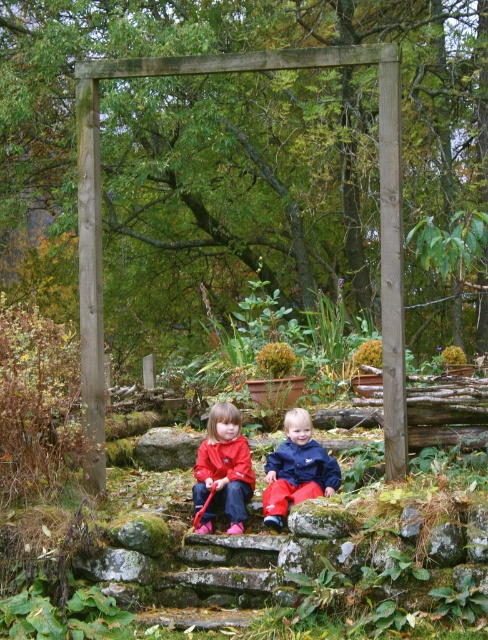
Question: Among these points, which one is farthest from the camera?

Choices:
 (A) (286, 429)
 (B) (226, 404)

Answer: (B)

Question: Is matte red jacket at center thinner than matte blue jacket at center?

Choices:
 (A) no
 (B) yes

Answer: (B)

Question: Does matte red jacket at center appear on the right side of matte blue jacket at center?

Choices:
 (A) yes
 (B) no

Answer: (B)

Question: Among these objects, which one is farthest from the camera?

Choices:
 (A) matte red jacket at center
 (B) matte blue jacket at center

Answer: (A)

Question: Does matte red jacket at center have a greater width compared to matte blue jacket at center?

Choices:
 (A) yes
 (B) no

Answer: (B)